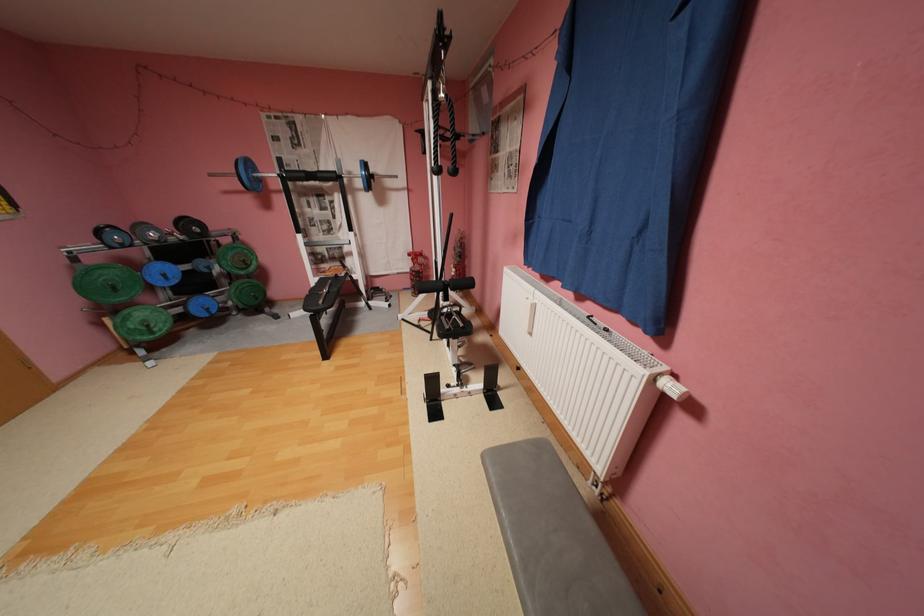
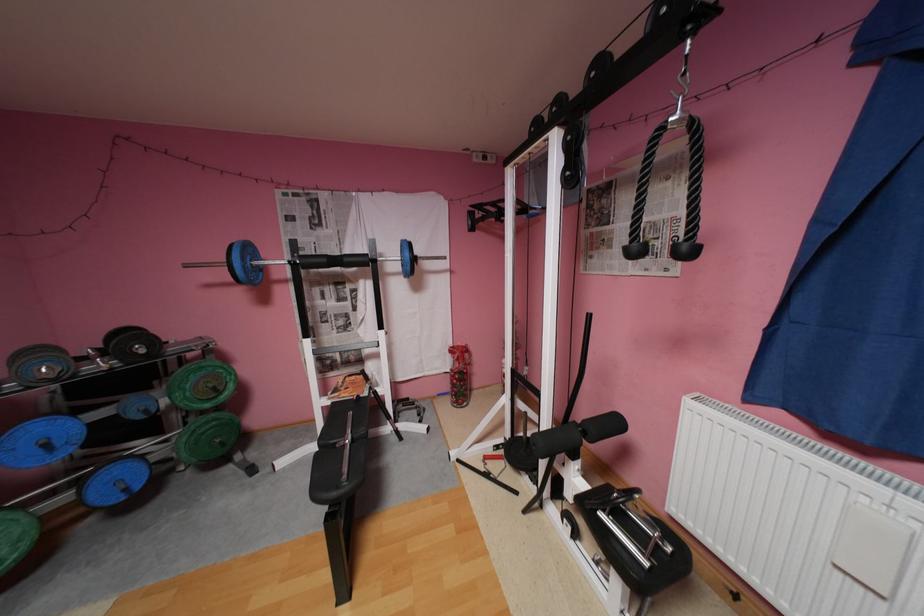
In the second image, find the point that corresponds to [327,175] in the first image.

(355, 259)